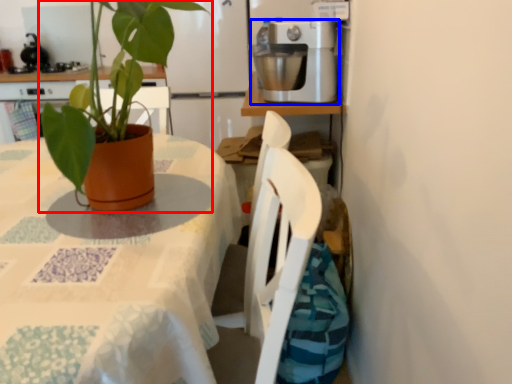
Question: Which object is further to the camera taking this photo, houseplant (highlighted by a red box) or kitchen appliance (highlighted by a blue box)?

Choices:
 (A) houseplant
 (B) kitchen appliance

Answer: (B)